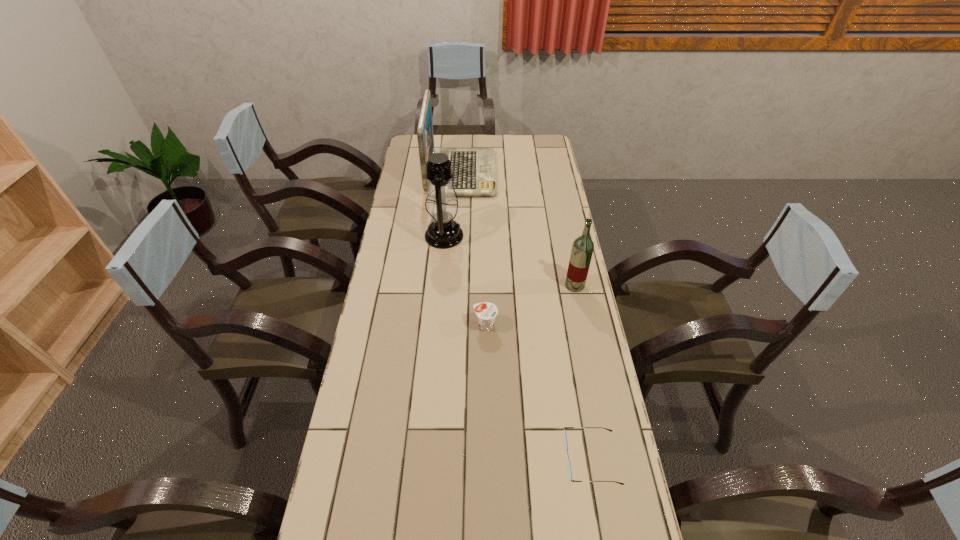
In the image, there is a desktop. Identify the location of vacant area at the left edge. (396, 435).

The height and width of the screenshot is (540, 960). In order to click on vacant space at the right edge of the desktop in this screenshot , I will do `click(536, 232)`.

You are a GUI agent. You are given a task and a screenshot of the screen. Output one action in this format:
    pyautogui.click(x=<x>, y=<y>)
    Task: Click on the vacant space at the far left corner of the desktop
    The height and width of the screenshot is (540, 960).
    Given the screenshot: What is the action you would take?
    pyautogui.click(x=407, y=153)

Locate an element on the screen. free spot between the shortest object and the oil lamp is located at coordinates (517, 347).

Identify the location of vacant space in between the farthest object and the nearest object. (526, 316).

Identify the location of vacant space in between the spectacles and the oil lamp. The image size is (960, 540). (517, 347).

At what (x,y) coordinates should I click in order to perform the action: click on vacant space that's between the oil lamp and the liquor. Please return your answer as a coordinate pair (x, y). The height and width of the screenshot is (540, 960). Looking at the image, I should click on (510, 261).

Find the location of a particular element. free point between the third farthest object and the oil lamp is located at coordinates (510, 261).

Where is `vacant space that's between the fourth farthest object and the liquor`? Image resolution: width=960 pixels, height=540 pixels. vacant space that's between the fourth farthest object and the liquor is located at coordinates (530, 306).

Locate which object is the second closest to the oil lamp. Please provide its 2D coordinates. Your answer should be formatted as a tuple, i.e. [(x, y)], where the tuple contains the x and y coordinates of a point satisfying the conditions above.

[(486, 312)]